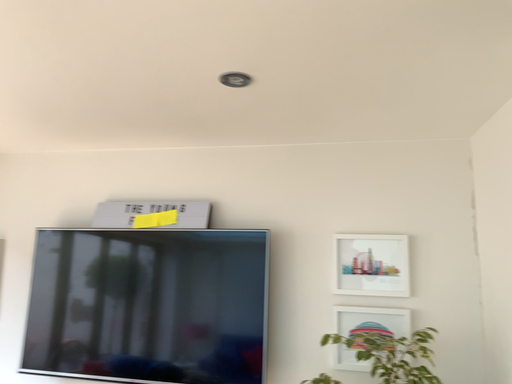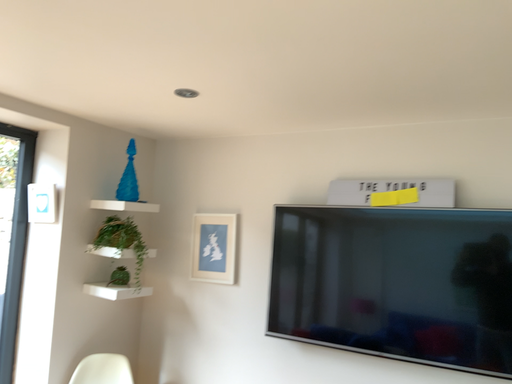
Question: How did the camera likely rotate when shooting the video?

Choices:
 (A) rotated left
 (B) rotated right

Answer: (A)